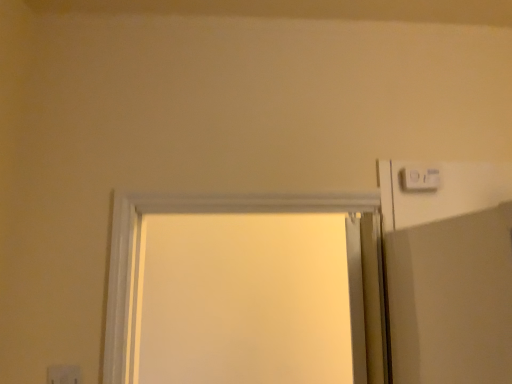
This screenshot has height=384, width=512. What are the coordinates of `white plastic light switch at upper right` in the screenshot? It's located at (420, 178).

Describe the element at coordinates (420, 178) in the screenshot. The image size is (512, 384). I see `white plastic light switch at upper right` at that location.

At what (x,y) coordinates should I click in order to perform the action: click on white plastic electric outlet at lower left. Please return your answer as a coordinate pair (x, y). This screenshot has height=384, width=512. Looking at the image, I should click on (64, 374).

Describe the element at coordinates (64, 374) in the screenshot. I see `white plastic electric outlet at lower left` at that location.

Where is `white plastic light switch at upper right`? This screenshot has width=512, height=384. white plastic light switch at upper right is located at coordinates (420, 178).

Based on their positions, is white plastic electric outlet at lower left located to the left or right of white plastic light switch at upper right?

Based on their positions, white plastic electric outlet at lower left is located to the left of white plastic light switch at upper right.

Does white plastic electric outlet at lower left lie in front of white plastic light switch at upper right?

Yes, it is.

Which is behind, point (76, 366) or point (405, 179)?

The point (405, 179) is farther from the camera.

From the image's perspective, which one is positioned lower, white plastic electric outlet at lower left or white plastic light switch at upper right?

white plastic electric outlet at lower left is shown below in the image.

From a real-world perspective, between white plastic electric outlet at lower left and white plastic light switch at upper right, who is vertically lower?

white plastic electric outlet at lower left, from a real-world perspective.

From the picture: Does white plastic electric outlet at lower left have a greater width compared to white plastic light switch at upper right?

In fact, white plastic electric outlet at lower left might be narrower than white plastic light switch at upper right.

Considering the sizes of objects white plastic electric outlet at lower left and white plastic light switch at upper right in the image provided, who is shorter, white plastic electric outlet at lower left or white plastic light switch at upper right?

white plastic light switch at upper right is shorter.

Is white plastic electric outlet at lower left bigger or smaller than white plastic light switch at upper right?

Clearly, white plastic electric outlet at lower left is smaller in size than white plastic light switch at upper right.

Is white plastic electric outlet at lower left situated inside white plastic light switch at upper right or outside?

white plastic electric outlet at lower left lies outside white plastic light switch at upper right.

Are white plastic electric outlet at lower left and white plastic light switch at upper right far apart?

Yes, white plastic electric outlet at lower left and white plastic light switch at upper right are located far from each other.

Could you tell me if white plastic electric outlet at lower left is turned towards white plastic light switch at upper right?

No, white plastic electric outlet at lower left does not turn towards white plastic light switch at upper right.

Where is `electric outlet located below the white plastic light switch at upper right (from the image's perspective)`? electric outlet located below the white plastic light switch at upper right (from the image's perspective) is located at coordinates (64, 374).

Is white plastic light switch at upper right at the left side of white plastic electric outlet at lower left?

No, white plastic light switch at upper right is not to the left of white plastic electric outlet at lower left.

Which object is closer to the camera taking this photo, white plastic light switch at upper right or white plastic electric outlet at lower left?

white plastic electric outlet at lower left is more forward.

Is point (426, 171) closer to viewer compared to point (73, 380)?

No, (426, 171) is further to viewer.

From the image's perspective, is white plastic light switch at upper right above or below white plastic electric outlet at lower left?

Based on their image positions, white plastic light switch at upper right is located above white plastic electric outlet at lower left.

From a real-world perspective, is white plastic light switch at upper right located beneath white plastic electric outlet at lower left?

Incorrect, from a real-world perspective, white plastic light switch at upper right is higher than white plastic electric outlet at lower left.

Does white plastic light switch at upper right have a lesser width compared to white plastic electric outlet at lower left?

No, white plastic light switch at upper right is not thinner than white plastic electric outlet at lower left.

Who is shorter, white plastic light switch at upper right or white plastic electric outlet at lower left?

white plastic light switch at upper right is shorter.

Which of these two, white plastic light switch at upper right or white plastic electric outlet at lower left, is smaller?

With smaller size is white plastic electric outlet at lower left.

Is white plastic light switch at upper right not inside white plastic electric outlet at lower left?

white plastic light switch at upper right is positioned outside white plastic electric outlet at lower left.

Is white plastic light switch at upper right directly adjacent to white plastic electric outlet at lower left?

No, white plastic light switch at upper right is not with white plastic electric outlet at lower left.

Is white plastic light switch at upper right aimed at white plastic electric outlet at lower left?

No, white plastic light switch at upper right is not turned towards white plastic electric outlet at lower left.

How different are the orientations of white plastic light switch at upper right and white plastic electric outlet at lower left in degrees?

3 degrees.

How far apart are white plastic light switch at upper right and white plastic electric outlet at lower left?

They are 3.55 feet apart.

The width and height of the screenshot is (512, 384). I want to click on light switch behind the white plastic electric outlet at lower left, so click(420, 178).

Image resolution: width=512 pixels, height=384 pixels. Find the location of `light switch on the right of white plastic electric outlet at lower left`. light switch on the right of white plastic electric outlet at lower left is located at coordinates (420, 178).

In the image, there is a white plastic light switch at upper right. What are the coordinates of `electric outlet below it (from a real-world perspective)` in the screenshot? It's located at (64, 374).